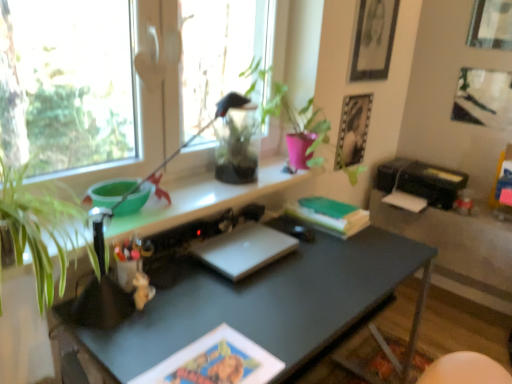
Question: Would you say metallic silver photo frame at upper right, placed as the 4th picture frame when sorted from right to left, is to the left or to the right of transparent glass vase at upper center in the picture?

Choices:
 (A) left
 (B) right

Answer: (B)

Question: Considering the positions of point (354, 145) and point (237, 109), is point (354, 145) closer or farther from the camera than point (237, 109)?

Choices:
 (A) closer
 (B) farther

Answer: (B)

Question: Based on their relative distances, which object is farther from the black plastic table at lower right?

Choices:
 (A) matte black picture frame at upper right, acting as the 2th picture frame starting from the left
 (B) metallic silver photo frame at upper right, placed as the 4th picture frame when sorted from right to left
 (C) green matte book at center
 (D) transparent glass vase at upper center
 (E) black plastic printer at right

Answer: (D)

Question: Based on their relative distances, which object is nearer to the green matte plant at upper center?

Choices:
 (A) black plastic printer at right
 (B) black plastic table at lower right
 (C) matte black picture frame at upper right, acting as the 2th picture frame starting from the left
 (D) metallic silver photo frame at upper right, positioned as the first picture frame in left-to-right order
 (E) wooden picture frame at upper right, the first picture frame in the right-to-left sequence

Answer: (D)